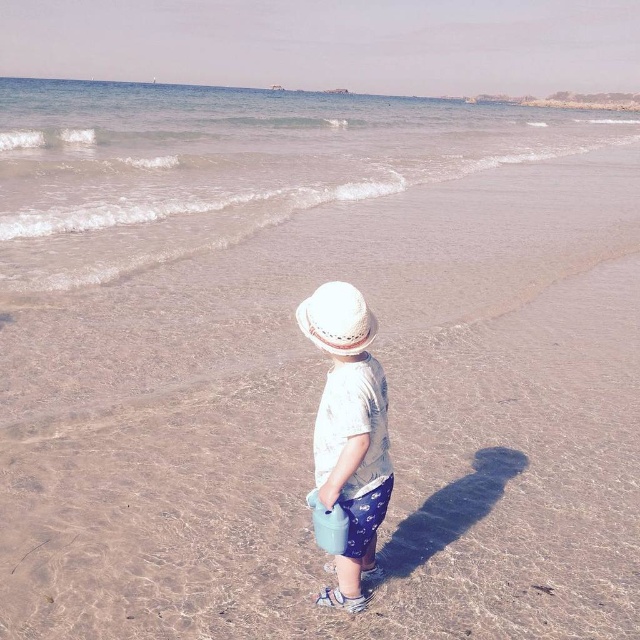
Based on the photo, can you confirm if white woven hat at center is positioned to the right of white straw hat at center?

Correct, you'll find white woven hat at center to the right of white straw hat at center.

Who is positioned more to the left, white woven hat at center or white straw hat at center?

From the viewer's perspective, white straw hat at center appears more on the left side.

Where is `white woven hat at center`? Image resolution: width=640 pixels, height=640 pixels. white woven hat at center is located at coordinates (349, 433).

Who is positioned more to the right, clear water at upper center or white straw hat at center?

From the viewer's perspective, white straw hat at center appears more on the right side.

Can you confirm if clear water at upper center is positioned to the left of white straw hat at center?

Correct, you'll find clear water at upper center to the left of white straw hat at center.

Between point (148, 148) and point (371, 332), which one is positioned in front?

Positioned in front is point (371, 332).

Find the location of a particular element. The width and height of the screenshot is (640, 640). clear water at upper center is located at coordinates (228, 164).

Who is positioned more to the right, clear water at upper center or white woven hat at center?

Positioned to the right is white woven hat at center.

Does clear water at upper center lie behind white woven hat at center?

Yes, it is.

Does point (508, 134) lie behind point (346, 481)?

Yes, it is behind point (346, 481).

Identify the location of clear water at upper center. The height and width of the screenshot is (640, 640). pyautogui.click(x=228, y=164).